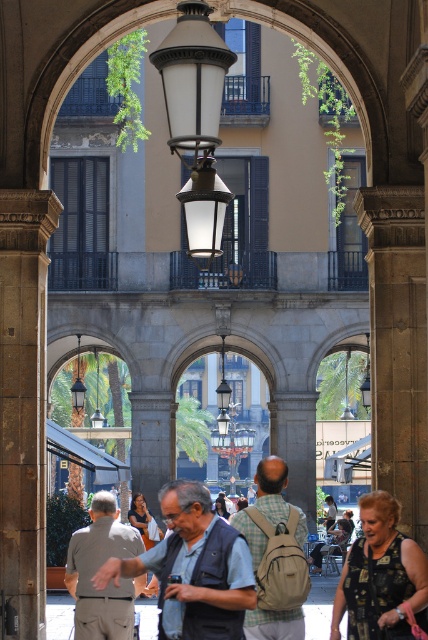
Question: Which is farther from the light brown backpack at center?

Choices:
 (A) printed fabric dress at center
 (B) gray fabric jacket at center
 (C) beige fabric backpack at center
 (D) gray fabric backpack at center

Answer: (A)

Question: Can you confirm if smooth stone column at left is positioned below gray fabric backpack at center?

Choices:
 (A) yes
 (B) no

Answer: (B)

Question: Does beige fabric backpack at center appear on the left side of matte black lamp at center?

Choices:
 (A) no
 (B) yes

Answer: (A)

Question: Which point appears closest to the camera in this image?

Choices:
 (A) (178, 120)
 (B) (24, 468)
 (C) (303, 532)
 (D) (380, 536)

Answer: (A)

Question: Can you confirm if beige fabric backpack at center is smaller than metallic glass lamp post at center?

Choices:
 (A) no
 (B) yes

Answer: (B)

Question: Among these points, which one is farthest from the camera?

Choices:
 (A) (204, 256)
 (B) (249, 433)
 (C) (225, 518)

Answer: (B)